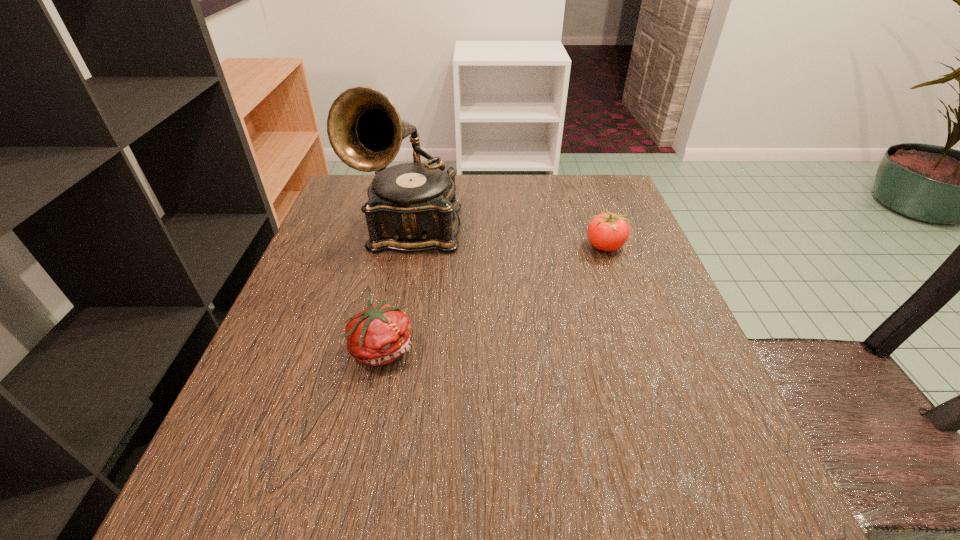
This screenshot has width=960, height=540. Find the location of `free point between the tallest object and the nearest object`. free point between the tallest object and the nearest object is located at coordinates (397, 288).

This screenshot has height=540, width=960. I want to click on unoccupied area between the nearer tomato and the right tomato, so click(493, 297).

The height and width of the screenshot is (540, 960). What are the coordinates of `unoccupied position between the phonograph record and the nearest object` in the screenshot? It's located at (397, 288).

You are a GUI agent. You are given a task and a screenshot of the screen. Output one action in this format:
    pyautogui.click(x=<x>, y=<y>)
    Task: Click on the free space between the tallest object and the right tomato
    The image size is (960, 540).
    Given the screenshot: What is the action you would take?
    pyautogui.click(x=508, y=238)

At what (x,y) coordinates should I click in order to perform the action: click on free area in between the right tomato and the phonograph record. Please return your answer as a coordinate pair (x, y). Looking at the image, I should click on (508, 238).

Identify the location of free space between the phonograph record and the rightmost object. (508, 238).

You are a GUI agent. You are given a task and a screenshot of the screen. Output one action in this format:
    pyautogui.click(x=<x>, y=<y>)
    Task: Click on the vacant point located between the left tomato and the phonograph record
    The height and width of the screenshot is (540, 960).
    Given the screenshot: What is the action you would take?
    pyautogui.click(x=397, y=288)

The image size is (960, 540). Identify the location of unoccupied position between the rightmost object and the tallest object. (508, 238).

Where is `vacant area that lies between the phonograph record and the left tomato`? This screenshot has height=540, width=960. vacant area that lies between the phonograph record and the left tomato is located at coordinates (397, 288).

Select which object appears as the closest to the rightmost object. Please provide its 2D coordinates. Your answer should be formatted as a tuple, i.e. [(x, y)], where the tuple contains the x and y coordinates of a point satisfying the conditions above.

[(412, 207)]